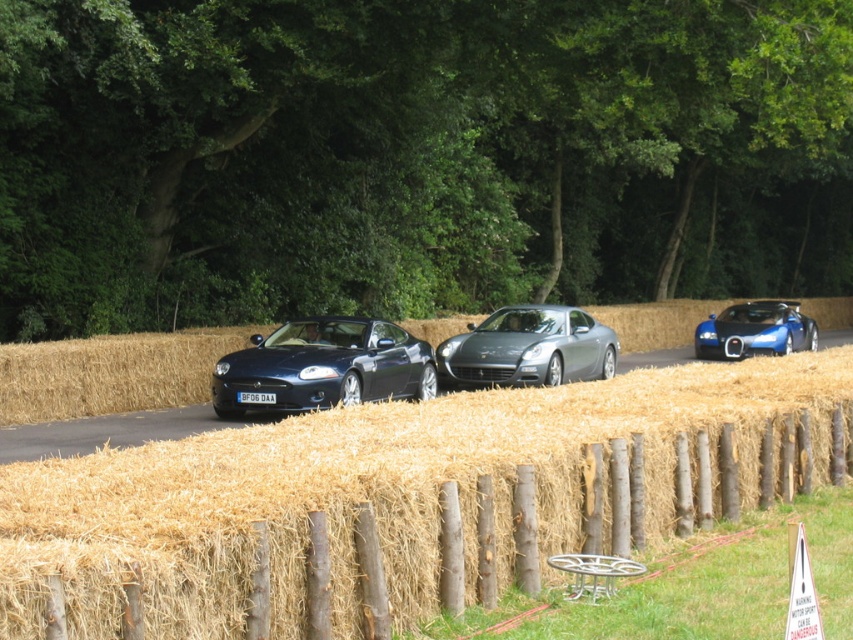
Does glossy metallic car at center have a larger size compared to satin silver car at center?

No.

How much distance is there between glossy metallic car at center and satin silver car at center?

glossy metallic car at center is 3.32 meters from satin silver car at center.

I want to click on glossy metallic car at center, so click(x=323, y=365).

Is satin silver car at center bigger than blue glossy sports car at right?

No.

Does satin silver car at center have a smaller size compared to blue glossy sports car at right?

Correct, satin silver car at center occupies less space than blue glossy sports car at right.

The image size is (853, 640). Describe the element at coordinates (527, 348) in the screenshot. I see `satin silver car at center` at that location.

Locate an element on the screen. The image size is (853, 640). satin silver car at center is located at coordinates (527, 348).

Between wooden post fence at center and glossy metallic car at center, which one is positioned higher?

wooden post fence at center is above.

Is wooden post fence at center below glossy metallic car at center?

No, wooden post fence at center is not below glossy metallic car at center.

The height and width of the screenshot is (640, 853). Identify the location of wooden post fence at center. (381, 509).

Locate an element on the screen. wooden post fence at center is located at coordinates (381, 509).